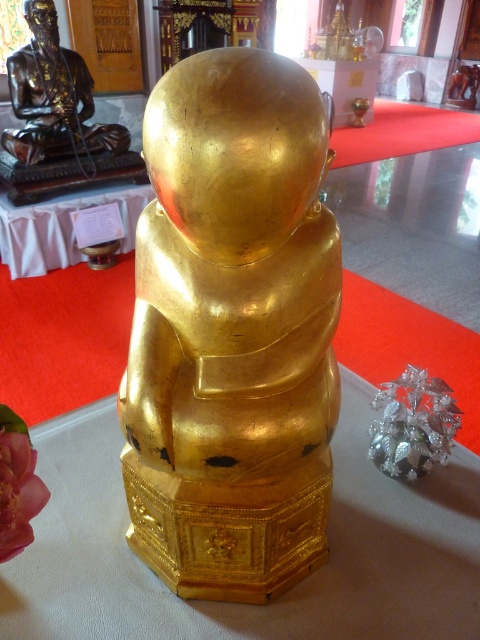
How distant is gold polished statue at center from bronze statue at upper left?

gold polished statue at center is 3.05 meters from bronze statue at upper left.

Does point (149, 422) lie in front of point (24, 131)?

That is True.

Describe the element at coordinates (232, 330) in the screenshot. I see `gold polished statue at center` at that location.

This screenshot has height=640, width=480. In order to click on gold polished statue at center in this screenshot , I will do `click(232, 330)`.